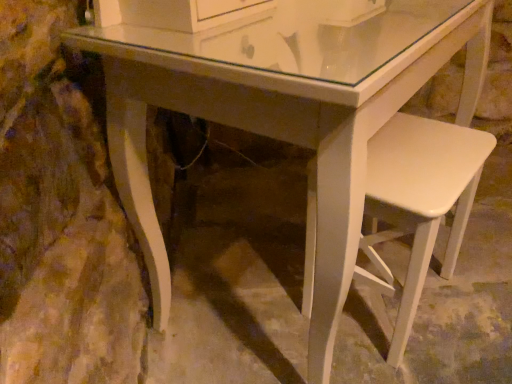
What are the coordinates of `free point above white matte wood bar stool at lower right (from a real-world perspective)` in the screenshot? It's located at (419, 154).